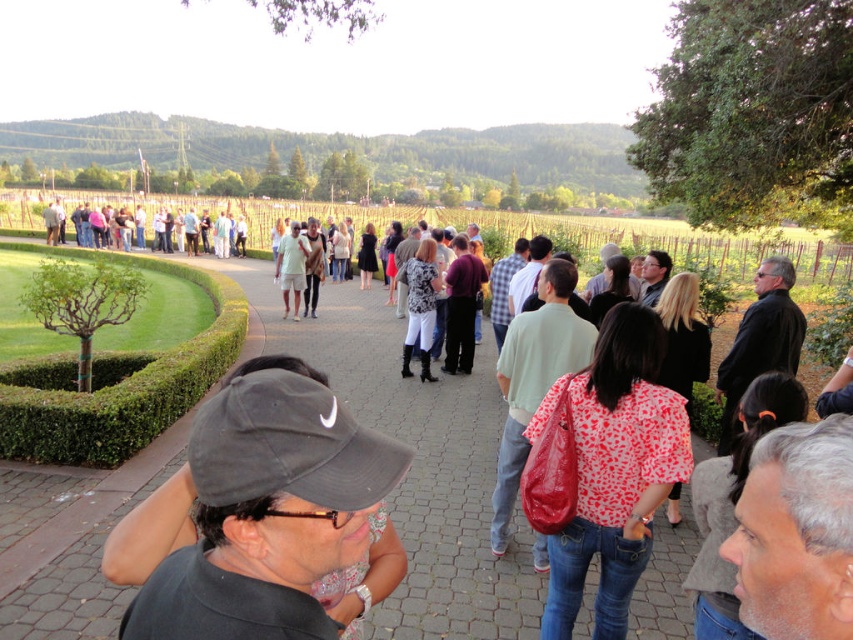
You are standing at the entrance of the vineyard pathway and see the green leafy hedge at lower left and the matte black jacket at center. Which object is closer to you?

The green leafy hedge at lower left is closer to you because it is in front of the matte black jacket at center.

You are a photographer setting up a shot of the vineyard event. You want to ensure the green leafy hedge at lower left and the matte black jacket at center are both in focus. Which object should you adjust your camera focus on first to account for their sizes?

The green leafy hedge at lower left has a lesser height compared to matte black jacket at center, so you should focus on the matte black jacket at center first since it is larger and might require more precise focusing.

You are standing at the entrance of the vineyard pathway and see the green leafy hedge at lower left and the black fabric cap at center. Which object is located to the left of the other?

The green leafy hedge at lower left is positioned on the left side of black fabric cap at center.